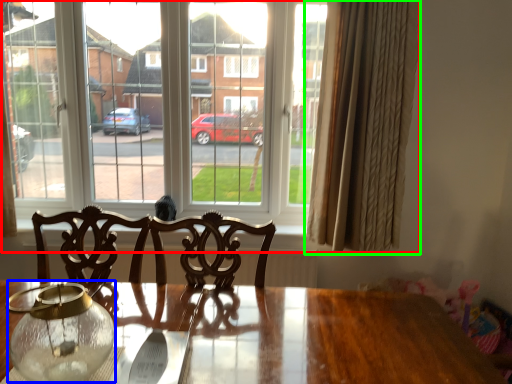
Question: Estimate the real-world distances between objects in this image. Which object is closer to window (highlighted by a red box), glass vase (highlighted by a blue box) or curtain (highlighted by a green box)?

Choices:
 (A) glass vase
 (B) curtain

Answer: (B)